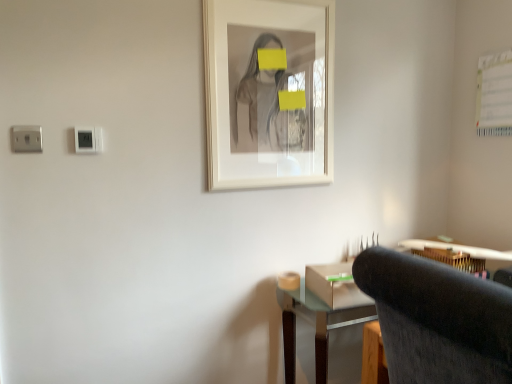
I want to click on dark gray fabric chair at lower right, so click(437, 320).

This screenshot has width=512, height=384. What do you see at coordinates (269, 92) in the screenshot?
I see `white matte picture frame at center` at bounding box center [269, 92].

Measure the distance between white plastic electric outlet at upper left and camera.

They are 4.72 feet apart.

Identify the location of white plastic electric outlet at upper left. (88, 140).

At what (x,y) coordinates should I click in order to perform the action: click on dark gray fabric chair at lower right. Please return your answer as a coordinate pair (x, y). Looking at the image, I should click on (437, 320).

Is dark gray fabric chair at lower right further to the viewer compared to wooden desk at lower right?

No.

Is dark gray fabric chair at lower right thinner than wooden desk at lower right?

No, dark gray fabric chair at lower right is not thinner than wooden desk at lower right.

How far apart are dark gray fabric chair at lower right and wooden desk at lower right?

They are 1.01 meters apart.

Looking at the image, does dark gray fabric chair at lower right seem bigger or smaller compared to wooden desk at lower right?

Clearly, dark gray fabric chair at lower right is larger in size than wooden desk at lower right.

Can you confirm if wooden desk at lower right is taller than white matte picture frame at center?

No, wooden desk at lower right is not taller than white matte picture frame at center.

Between wooden desk at lower right and white matte picture frame at center, which one has larger size?

wooden desk at lower right is bigger.

From the image's perspective, who appears lower, wooden desk at lower right or white matte picture frame at center?

wooden desk at lower right, from the image's perspective.

Is wooden desk at lower right further to the viewer compared to white matte picture frame at center?

Yes, wooden desk at lower right is further from the viewer.

Between dark gray fabric chair at lower right and white plastic electric outlet at upper left, which one is positioned in front?

dark gray fabric chair at lower right.

Is dark gray fabric chair at lower right bigger than white plastic electric outlet at upper left?

Correct, dark gray fabric chair at lower right is larger in size than white plastic electric outlet at upper left.

Could you tell me if dark gray fabric chair at lower right is facing white plastic electric outlet at upper left?

No, dark gray fabric chair at lower right does not turn towards white plastic electric outlet at upper left.

Is white plastic electric outlet at upper left inside dark gray fabric chair at lower right?

No.

How different are the orientations of white plastic electric outlet at upper left and wooden desk at lower right in degrees?

There is a 2.02-degree angle between the facing directions of white plastic electric outlet at upper left and wooden desk at lower right.

From a real-world perspective, is white plastic electric outlet at upper left located beneath wooden desk at lower right?

Actually, white plastic electric outlet at upper left is physically above wooden desk at lower right in the real world.

Is white plastic electric outlet at upper left aimed at wooden desk at lower right?

No, white plastic electric outlet at upper left is not oriented towards wooden desk at lower right.

Is white plastic electric outlet at upper left positioned in front of wooden desk at lower right?

Yes, white plastic electric outlet at upper left is closer to the camera.

Is white matte picture frame at center positioned in front of dark gray fabric chair at lower right?

No.

Consider the image. Is white matte picture frame at center aimed at dark gray fabric chair at lower right?

Yes, white matte picture frame at center faces towards dark gray fabric chair at lower right.

Is dark gray fabric chair at lower right inside white matte picture frame at center?

No, white matte picture frame at center does not contain dark gray fabric chair at lower right.

Is white matte picture frame at center positioned far away from dark gray fabric chair at lower right?

white matte picture frame at center is actually quite close to dark gray fabric chair at lower right.

Which object is more forward, white plastic electric outlet at upper left or dark gray fabric chair at lower right?

dark gray fabric chair at lower right is closer to the camera.

In the scene shown: From a real-world perspective, relative to dark gray fabric chair at lower right, is white plastic electric outlet at upper left vertically above or below?

From a real-world perspective, white plastic electric outlet at upper left is physically above dark gray fabric chair at lower right.

Is white plastic electric outlet at upper left smaller than dark gray fabric chair at lower right?

Yes, white plastic electric outlet at upper left is smaller than dark gray fabric chair at lower right.

The height and width of the screenshot is (384, 512). In the image, there is a dark gray fabric chair at lower right. Identify the location of electric outlet above it (from the image's perspective). (x=88, y=140).

Which of these two, dark gray fabric chair at lower right or white matte picture frame at center, is smaller?

white matte picture frame at center is smaller.

Does point (504, 313) lie behind point (219, 133)?

That is False.

Is white matte picture frame at center a part of dark gray fabric chair at lower right?

No.

Is dark gray fabric chair at lower right beside white matte picture frame at center?

No, dark gray fabric chair at lower right is not beside white matte picture frame at center.

At what (x,y) coordinates should I click in order to perform the action: click on computer desk located underneath the dark gray fabric chair at lower right (from a real-world perspective). Please return your answer as a coordinate pair (x, y). This screenshot has width=512, height=384. Looking at the image, I should click on pos(456,254).

Where is `computer desk on the right of the white matte picture frame at center`? Image resolution: width=512 pixels, height=384 pixels. computer desk on the right of the white matte picture frame at center is located at coordinates (456, 254).

Looking at this image, from the image, which object appears to be farther from dark gray fabric chair at lower right, white matte picture frame at center or wooden desk at lower right?

Among the two, wooden desk at lower right is located further to dark gray fabric chair at lower right.

Looking at the image, which one is located closer to wooden desk at lower right, dark gray fabric chair at lower right or white matte picture frame at center?

white matte picture frame at center is positioned closer to the anchor wooden desk at lower right.

Consider the image. From the image, which object appears to be farther from wooden desk at lower right, white plastic electric outlet at upper left or white matte picture frame at center?

white plastic electric outlet at upper left lies further to wooden desk at lower right than the other object.

Consider the image. Looking at the image, which one is located closer to dark gray fabric chair at lower right, wooden desk at lower right or white plastic electric outlet at upper left?

Based on the image, wooden desk at lower right appears to be nearer to dark gray fabric chair at lower right.

Based on their spatial positions, is dark gray fabric chair at lower right or white plastic electric outlet at upper left closer to white matte picture frame at center?

Based on the image, white plastic electric outlet at upper left appears to be nearer to white matte picture frame at center.

Considering their positions, is white matte picture frame at center positioned closer to wooden desk at lower right than white plastic electric outlet at upper left?

white matte picture frame at center is closer to wooden desk at lower right.

Looking at the image, which one is located further to white plastic electric outlet at upper left, white matte picture frame at center or wooden desk at lower right?

Among the two, wooden desk at lower right is located further to white plastic electric outlet at upper left.

Estimate the real-world distances between objects in this image. Which object is closer to white plastic electric outlet at upper left, white matte picture frame at center or dark gray fabric chair at lower right?

white matte picture frame at center is positioned closer to the anchor white plastic electric outlet at upper left.

The image size is (512, 384). Find the location of `picture frame between white plastic electric outlet at upper left and dark gray fabric chair at lower right in the horizontal direction`. picture frame between white plastic electric outlet at upper left and dark gray fabric chair at lower right in the horizontal direction is located at coordinates (269, 92).

Identify the location of picture frame positioned between dark gray fabric chair at lower right and wooden desk at lower right from near to far. This screenshot has width=512, height=384. (269, 92).

At what (x,y) coordinates should I click in order to perform the action: click on chair situated between white plastic electric outlet at upper left and wooden desk at lower right from left to right. Please return your answer as a coordinate pair (x, y). Image resolution: width=512 pixels, height=384 pixels. Looking at the image, I should click on (437, 320).

The width and height of the screenshot is (512, 384). Identify the location of picture frame between white plastic electric outlet at upper left and wooden desk at lower right in the horizontal direction. (269, 92).